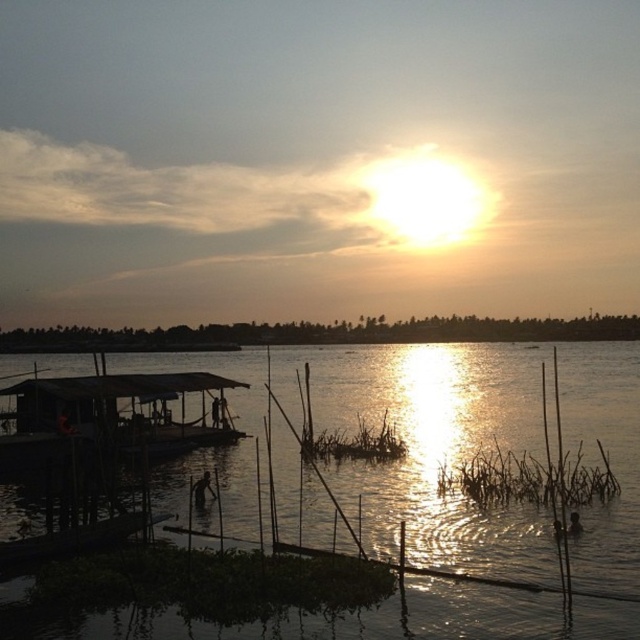
Question: From the image, what is the correct spatial relationship of translucent water at center in relation to wooden boat at left?

Choices:
 (A) left
 (B) right

Answer: (B)

Question: Which point is farther from the camera taking this photo?

Choices:
 (A) (326, 412)
 (B) (198, 394)

Answer: (A)

Question: Does translucent water at center have a greater width compared to wooden boat at left?

Choices:
 (A) yes
 (B) no

Answer: (A)

Question: Is translucent water at center thinner than wooden boat at left?

Choices:
 (A) yes
 (B) no

Answer: (B)